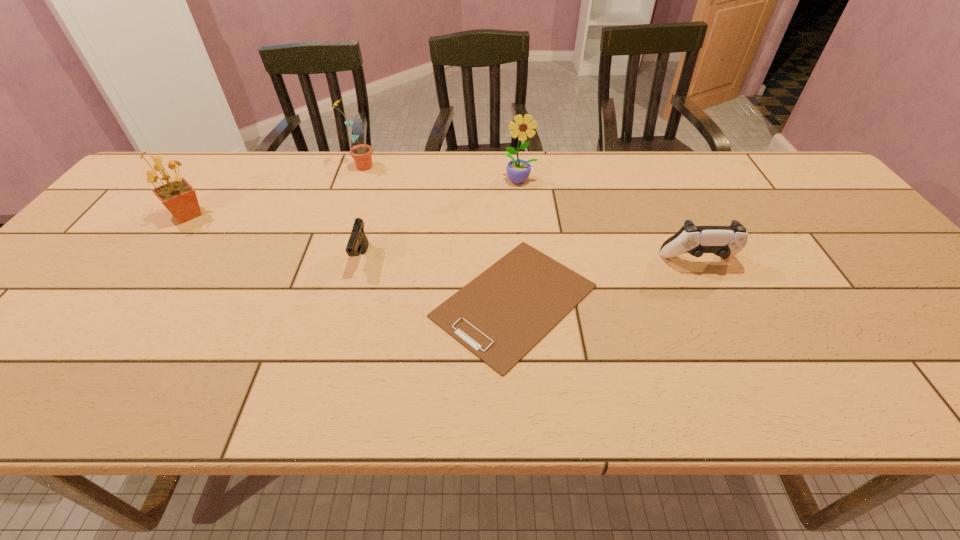
At what (x,y) coordinates should I click in order to perform the action: click on vacant space located on the flower of the second sunflower from right to left. Please return your answer as a coordinate pair (x, y). The width and height of the screenshot is (960, 540). Looking at the image, I should click on (397, 167).

Identify the location of vacant region located 0.290m at the front of the third farthest object with flowers visible. (314, 215).

Locate an element on the screen. The image size is (960, 540). vacant space located on the front-facing side of the fourth tallest object is located at coordinates (726, 319).

Locate an element on the screen. The image size is (960, 540). free spot located at the barrel of the pistol is located at coordinates (333, 366).

Identify the location of vacant space located 0.220m on the back of the clipboard. This screenshot has width=960, height=540. (507, 193).

This screenshot has height=540, width=960. Find the location of `object that is at the near edge`. object that is at the near edge is located at coordinates 499,316.

Image resolution: width=960 pixels, height=540 pixels. I want to click on object that is at the left edge, so click(x=179, y=197).

This screenshot has width=960, height=540. In the image, there is a desktop. Find the location of `vacant space at the far edge`. vacant space at the far edge is located at coordinates (642, 169).

Locate an element on the screen. vacant space at the near edge of the desktop is located at coordinates (347, 375).

Identify the location of vacant region at the left edge of the desktop. This screenshot has width=960, height=540. (115, 213).